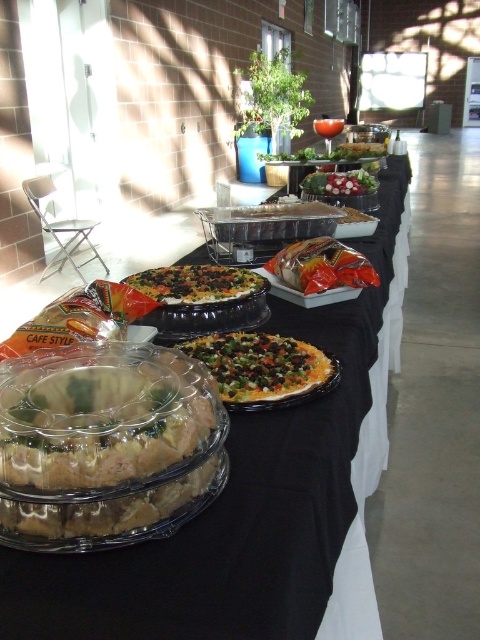
You are standing at the buffet table and want to grab two items. The first is at point (307, 602) and the second is at point (355, 172). Which item should you reach for first to minimize the distance walked?

You should reach for the item at point (307, 602) first because it is closer to you than the item at point (355, 172).

You are standing at the buffet table and want to reach the item located at point (315, 460). If your arm can extend 28 inches, will you be able to reach it?

The point (315, 460) is 29.23 inches from the camera, which is slightly beyond your arm extension of 28 inches. Therefore, you may not be able to reach it without moving closer.